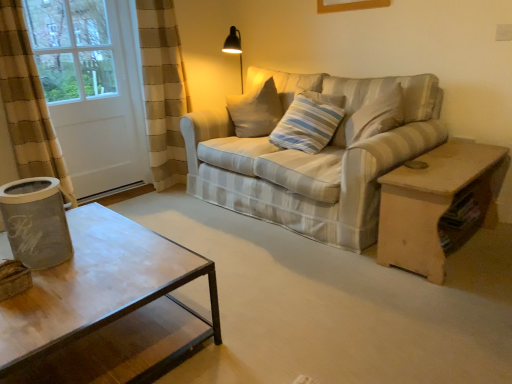
Question: Considering the positions of point (296, 230) and point (331, 107), is point (296, 230) closer or farther from the camera than point (331, 107)?

Choices:
 (A) closer
 (B) farther

Answer: (A)

Question: Considering the positions of striped fabric couch at center and striped fabric pillow at center in the image, is striped fabric couch at center wider or thinner than striped fabric pillow at center?

Choices:
 (A) thin
 (B) wide

Answer: (B)

Question: Which object is the farthest from the white matte screen door at left?

Choices:
 (A) light brown wooden table at right
 (B) striped fabric couch at center
 (C) striped fabric pillow at center

Answer: (A)

Question: Estimate the real-world distances between objects in this image. Which object is closer to the light brown wooden table at right?

Choices:
 (A) white matte screen door at left
 (B) striped fabric couch at center
 (C) striped fabric pillow at center

Answer: (B)